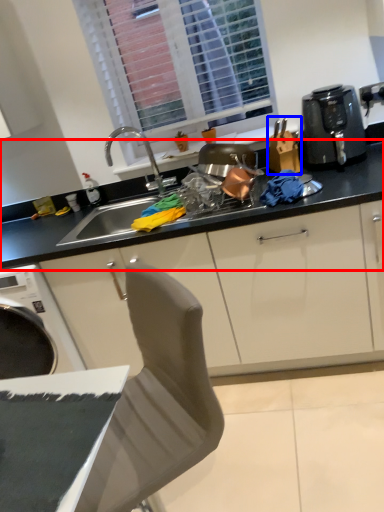
Question: Among these objects, which one is nearest to the camera, countertop (highlighted by a red box) or appliance (highlighted by a blue box)?

Choices:
 (A) countertop
 (B) appliance

Answer: (B)